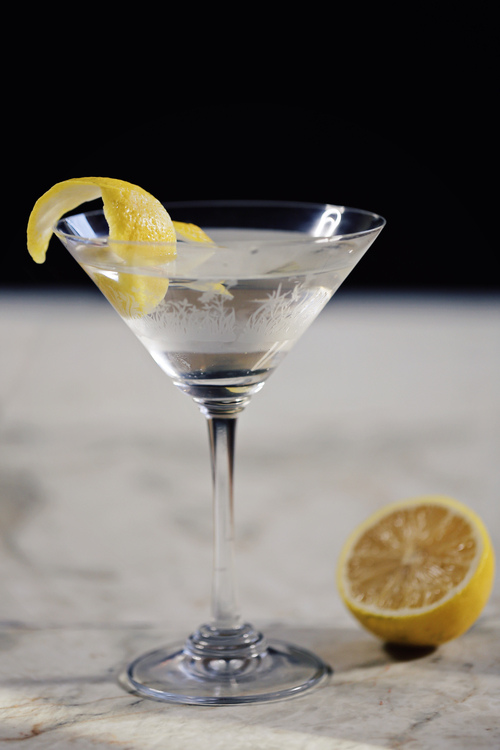
Find the location of a particular element. martini glass is located at coordinates (266, 214).